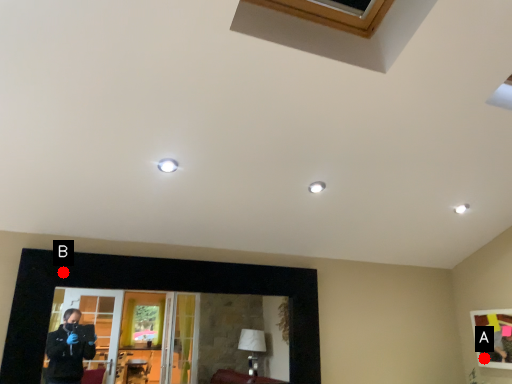
Question: Two points are circled on the image, labeled by A and B beside each circle. Among these points, which one is farthest from the camera?

Choices:
 (A) A is further
 (B) B is further

Answer: (A)